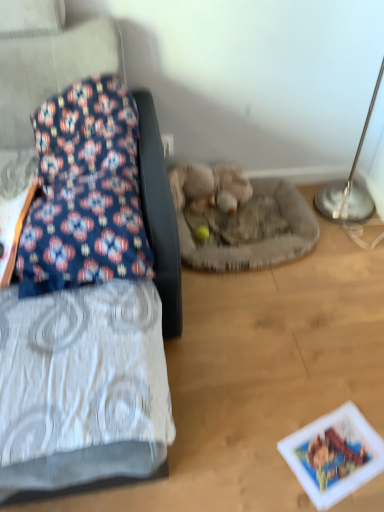
At what (x,y) coordinates should I click in order to perform the action: click on printed paper postcard at lower right. Please return your answer as a coordinate pair (x, y). Image resolution: width=384 pixels, height=512 pixels. Looking at the image, I should click on (334, 455).

What do you see at coordinates (40, 83) in the screenshot? The width and height of the screenshot is (384, 512). I see `floral fabric cushion at left` at bounding box center [40, 83].

The image size is (384, 512). I want to click on floral fabric cushion at left, so click(40, 83).

Image resolution: width=384 pixels, height=512 pixels. Describe the element at coordinates (349, 184) in the screenshot. I see `silver metallic table lamp at upper right` at that location.

What do you see at coordinates (85, 192) in the screenshot? I see `floral fabric pillow at left` at bounding box center [85, 192].

The height and width of the screenshot is (512, 384). What are the coordinates of `fuzzy beige stuffed animal at center` in the screenshot? It's located at (207, 182).

From the image's perspective, which object appears higher, floral fabric cushion at left or floral fabric pillow at left?

floral fabric pillow at left, from the image's perspective.

Is floral fabric cushion at left inside the boundaries of floral fabric pillow at left, or outside?

floral fabric cushion at left lies outside floral fabric pillow at left.

Where is `pillow lying on the right of floral fabric cushion at left`? This screenshot has width=384, height=512. pillow lying on the right of floral fabric cushion at left is located at coordinates (85, 192).

In the scene shown: Is floral fabric cushion at left wider or thinner than floral fabric pillow at left?

Clearly, floral fabric cushion at left has more width compared to floral fabric pillow at left.

Based on the photo, considering the relative sizes of printed paper postcard at lower right and silver metallic table lamp at upper right in the image provided, is printed paper postcard at lower right wider than silver metallic table lamp at upper right?

No, printed paper postcard at lower right is not wider than silver metallic table lamp at upper right.

The width and height of the screenshot is (384, 512). I want to click on postcard beneath the silver metallic table lamp at upper right (from a real-world perspective), so click(334, 455).

Considering the relative sizes of printed paper postcard at lower right and silver metallic table lamp at upper right in the image provided, is printed paper postcard at lower right shorter than silver metallic table lamp at upper right?

Correct, printed paper postcard at lower right is not as tall as silver metallic table lamp at upper right.

Can you confirm if printed paper postcard at lower right is positioned to the right of silver metallic table lamp at upper right?

Incorrect, printed paper postcard at lower right is not on the right side of silver metallic table lamp at upper right.

Which of these two, printed paper postcard at lower right or fuzzy beige stuffed animal at center, stands shorter?

printed paper postcard at lower right is shorter.

Is printed paper postcard at lower right positioned with its back to fuzzy beige stuffed animal at center?

No, printed paper postcard at lower right's orientation is not away from fuzzy beige stuffed animal at center.

From the image's perspective, which one is positioned lower, printed paper postcard at lower right or fuzzy beige stuffed animal at center?

printed paper postcard at lower right, from the image's perspective.

Locate an element on the screen. Image resolution: width=384 pixels, height=512 pixels. table lamp beneath the floral fabric pillow at left (from a real-world perspective) is located at coordinates (349, 184).

Is the position of floral fabric pillow at left more distant than that of silver metallic table lamp at upper right?

No.

Is floral fabric pillow at left looking in the opposite direction of silver metallic table lamp at upper right?

No, floral fabric pillow at left is not facing the opposite direction of silver metallic table lamp at upper right.

Which object is more forward, floral fabric cushion at left or silver metallic table lamp at upper right?

floral fabric cushion at left is closer to the camera.

Visually, is floral fabric cushion at left positioned to the left or to the right of silver metallic table lamp at upper right?

Based on their positions, floral fabric cushion at left is located to the left of silver metallic table lamp at upper right.

Is floral fabric cushion at left bigger or smaller than silver metallic table lamp at upper right?

floral fabric cushion at left is bigger than silver metallic table lamp at upper right.

Is printed paper postcard at lower right facing away from floral fabric cushion at left?

That's not correct — printed paper postcard at lower right is not looking away from floral fabric cushion at left.

Which is less distant, (310, 455) or (77, 69)?

Point (310, 455)

From a real-world perspective, is printed paper postcard at lower right located beneath floral fabric cushion at left?

Yes, from a real-world perspective, printed paper postcard at lower right is under floral fabric cushion at left.

How far apart are printed paper postcard at lower right and floral fabric cushion at left?

printed paper postcard at lower right is 84.02 centimeters away from floral fabric cushion at left.

Which object is positioned more to the right, fuzzy beige stuffed animal at center or silver metallic table lamp at upper right?

silver metallic table lamp at upper right is more to the right.

Is fuzzy beige stuffed animal at center bigger than silver metallic table lamp at upper right?

Actually, fuzzy beige stuffed animal at center might be smaller than silver metallic table lamp at upper right.

This screenshot has width=384, height=512. In order to click on pillow above the floral fabric cushion at left (from a real-world perspective) in this screenshot , I will do `click(85, 192)`.

The image size is (384, 512). Identify the location of postcard lying in front of the silver metallic table lamp at upper right. (334, 455).

Based on their spatial positions, is floral fabric pillow at left or printed paper postcard at lower right closer to fuzzy beige stuffed animal at center?

floral fabric pillow at left is closer to fuzzy beige stuffed animal at center.

When comparing their distances from floral fabric pillow at left, does printed paper postcard at lower right or floral fabric cushion at left seem further?

printed paper postcard at lower right is positioned further to the anchor floral fabric pillow at left.

Looking at the image, which one is located closer to floral fabric pillow at left, floral fabric cushion at left or silver metallic table lamp at upper right?

The object closer to floral fabric pillow at left is floral fabric cushion at left.

Considering their positions, is fuzzy beige stuffed animal at center positioned further to printed paper postcard at lower right than silver metallic table lamp at upper right?

fuzzy beige stuffed animal at center is further to printed paper postcard at lower right.

Based on their spatial positions, is fuzzy beige stuffed animal at center or floral fabric pillow at left closer to silver metallic table lamp at upper right?

fuzzy beige stuffed animal at center is positioned closer to the anchor silver metallic table lamp at upper right.

Looking at the image, which one is located closer to fuzzy beige stuffed animal at center, floral fabric cushion at left or silver metallic table lamp at upper right?

Based on the image, floral fabric cushion at left appears to be nearer to fuzzy beige stuffed animal at center.

Which object lies nearer to the anchor point silver metallic table lamp at upper right, printed paper postcard at lower right or floral fabric pillow at left?

The object closer to silver metallic table lamp at upper right is printed paper postcard at lower right.

When comparing their distances from silver metallic table lamp at upper right, does fuzzy beige stuffed animal at center or printed paper postcard at lower right seem further?

Among the two, printed paper postcard at lower right is located further to silver metallic table lamp at upper right.

Find the location of a particular element. The width and height of the screenshot is (384, 512). pillow that lies between fuzzy beige stuffed animal at center and printed paper postcard at lower right from top to bottom is located at coordinates (85, 192).

This screenshot has height=512, width=384. I want to click on pillow situated between floral fabric cushion at left and silver metallic table lamp at upper right from left to right, so click(85, 192).

I want to click on pillow located between floral fabric cushion at left and printed paper postcard at lower right in the left-right direction, so click(x=85, y=192).

Image resolution: width=384 pixels, height=512 pixels. What are the coordinates of `postcard between floral fabric cushion at left and silver metallic table lamp at upper right` in the screenshot? It's located at (334, 455).